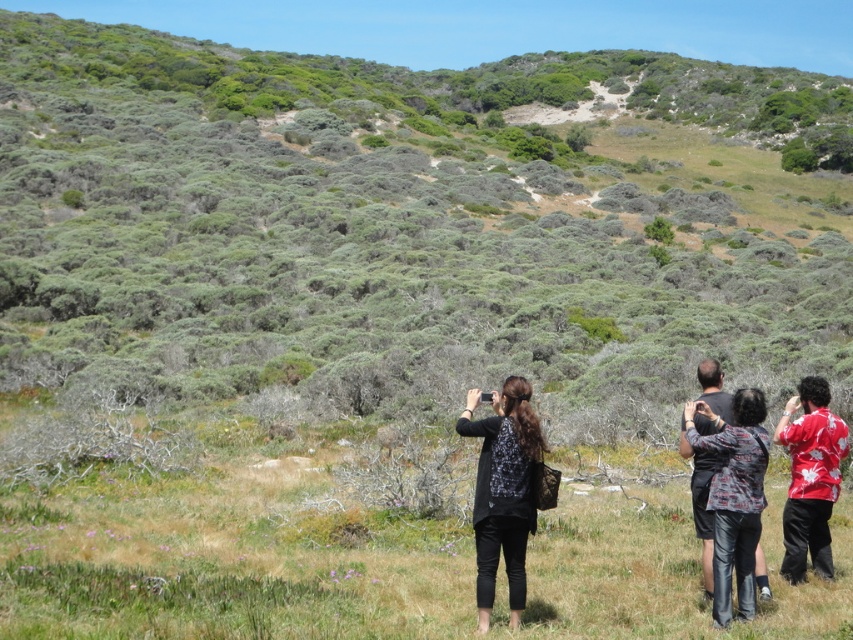
You are a photographer trying to capture a group shot of the black matte jacket at center and the red hawaiian shirt at right. Since you want to ensure both subjects are clearly visible, which direction should you position yourself relative to the group?

You should position yourself to the left of the group because the black matte jacket at center is on the left side of the red hawaiian shirt at right, ensuring both are visible without obstruction.

You are a photographer trying to capture a photo of the printed fabric shirt at center and the red hawaiian shirt at right. Based on their positions, which shirt should you focus on first if you want to include both in the frame without moving the camera?

A: The printed fabric shirt at center is positioned on the left side of red hawaiian shirt at right, so you should focus on the printed fabric shirt at center first to ensure both are included in the frame.